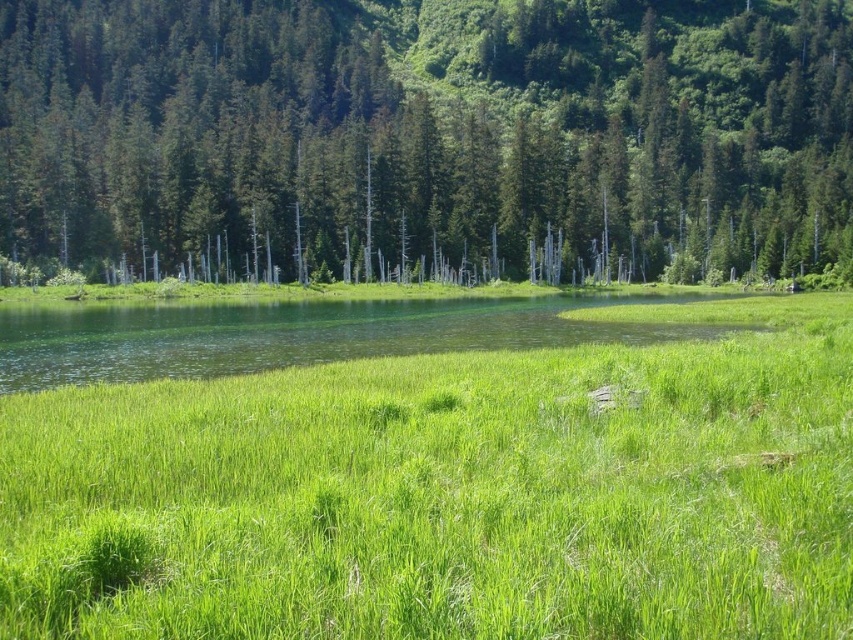
Please look at the image. There is a point at coordinates (450,493). What is the object located at this point?

The point at coordinates (450,493) is located in the green grassy area at center.

You are standing in the middle of the green grassy at center and want to look up at the green matte tree at center. Is the tree above or below you?

The green grassy at center is below the green matte tree at center, so the tree is above you.